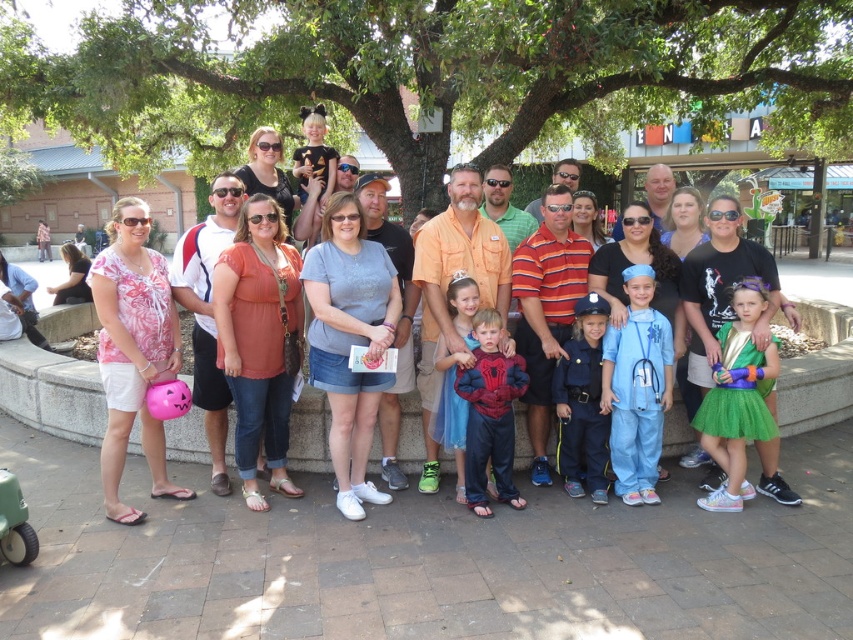
Question: Can you confirm if blue cotton scrubs at center is wider than white cotton shirt at center?

Choices:
 (A) no
 (B) yes

Answer: (B)

Question: From the image, what is the correct spatial relationship of orange cotton shirt at center in relation to striped polo shirt at center?

Choices:
 (A) right
 (B) left

Answer: (B)

Question: Which is nearer to the striped polo shirt at center?

Choices:
 (A) green tulle dress at center
 (B) shiny blue costume at center

Answer: (B)

Question: Can you confirm if green leafy tree at upper center is thinner than matte pink pumpkin bucket at left?

Choices:
 (A) no
 (B) yes

Answer: (A)

Question: Considering the real-world distances, which object is farthest from the shiny blue costume at center?

Choices:
 (A) striped polo shirt at center
 (B) matte pink pumpkin bucket at left
 (C) blue fabric uniform at center

Answer: (B)

Question: Which point is closer to the camera?

Choices:
 (A) (195, 385)
 (B) (708, 352)
 (C) (746, 428)
 (D) (471, 404)

Answer: (C)